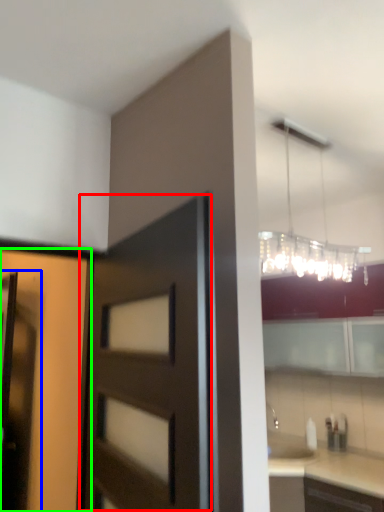
Question: Which object is positioned farthest from door (highlighted by a red box)? Select from screen door (highlighted by a blue box) and door (highlighted by a green box).

Choices:
 (A) screen door
 (B) door

Answer: (A)